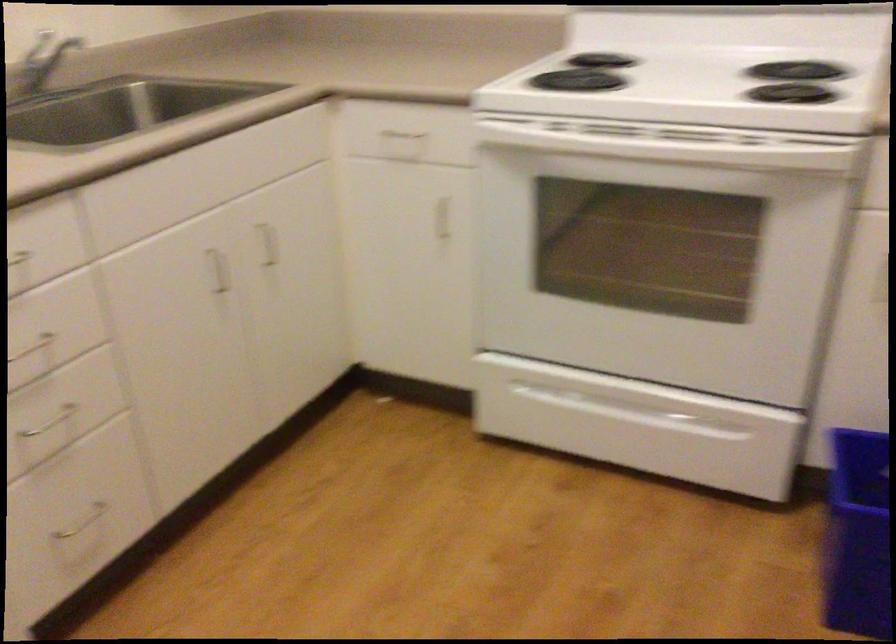
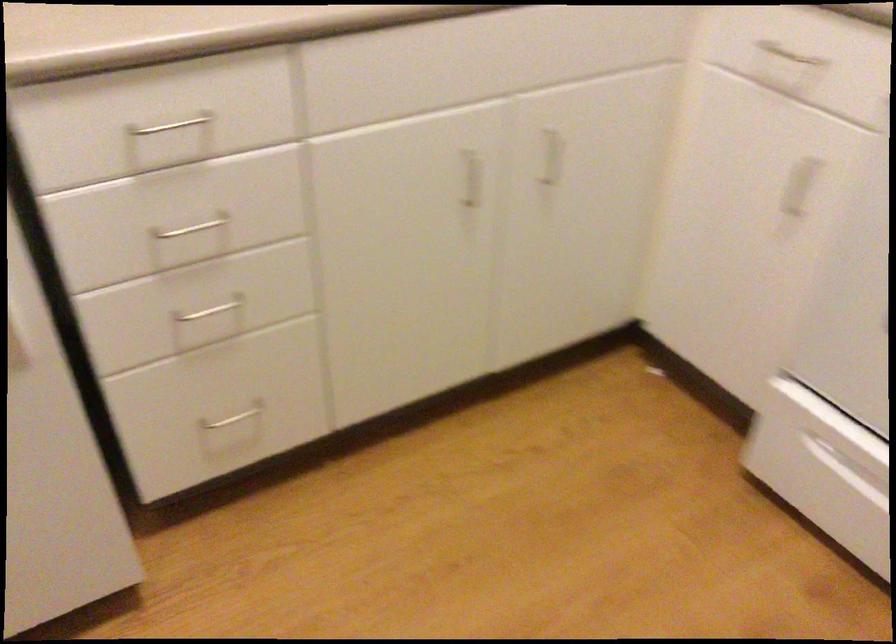
Locate, in the second image, the point that corresponds to (x=401, y=138) in the first image.

(789, 55)